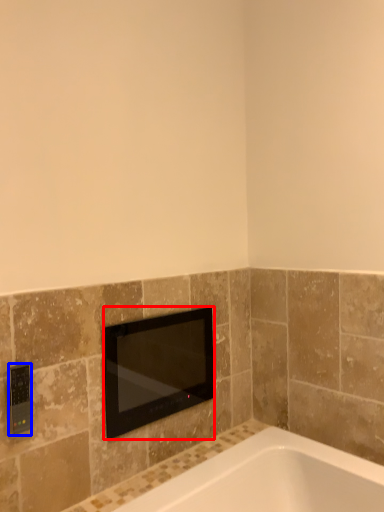
Question: Which of the following is the closest to the observer, television (highlighted by a red box) or light switch (highlighted by a blue box)?

Choices:
 (A) television
 (B) light switch

Answer: (B)